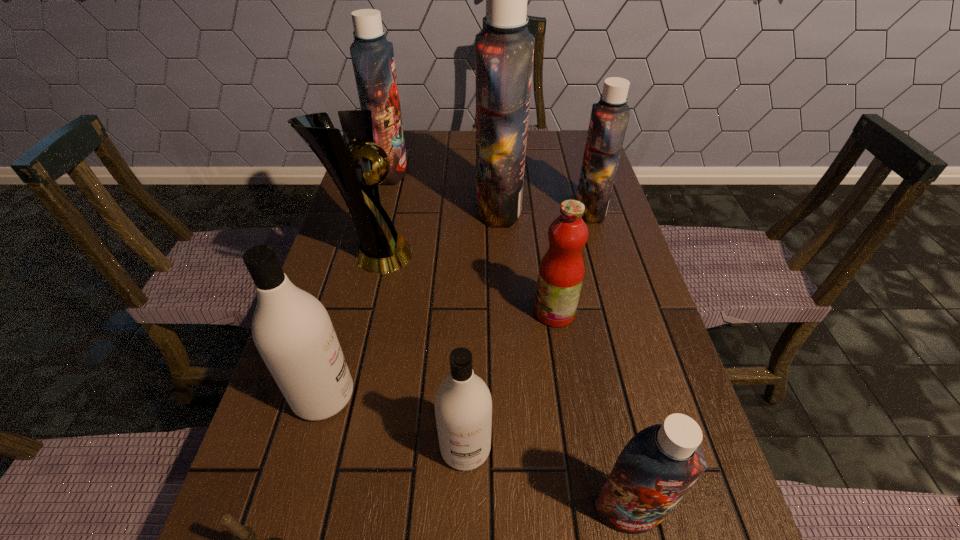
Where is `vacant space located 0.080m on the front-facing side of the left white shampoo`? This screenshot has width=960, height=540. vacant space located 0.080m on the front-facing side of the left white shampoo is located at coordinates (396, 395).

The width and height of the screenshot is (960, 540). Find the location of `blank space located 0.140m on the front label of the fruit juice`. blank space located 0.140m on the front label of the fruit juice is located at coordinates (471, 312).

I want to click on vacant space positioned 0.080m on the front label of the fruit juice, so click(x=498, y=312).

Where is `vacant space located on the front label of the fruit juice`? The image size is (960, 540). vacant space located on the front label of the fruit juice is located at coordinates (359, 312).

Find the location of a particular element. This screenshot has height=540, width=960. free space located 0.080m on the front-facing side of the right white shampoo is located at coordinates (464, 527).

What are the coordinates of `object that is at the far edge` in the screenshot? It's located at (372, 55).

Where is `award that is at the left edge`? The image size is (960, 540). award that is at the left edge is located at coordinates (355, 169).

Where is `object that is at the far left corner`? object that is at the far left corner is located at coordinates (372, 55).

Image resolution: width=960 pixels, height=540 pixels. Find the location of `vacant space at the far edge of the desktop`. vacant space at the far edge of the desktop is located at coordinates (455, 165).

Locate an element on the screen. The height and width of the screenshot is (540, 960). blank space at the left edge of the desktop is located at coordinates (299, 461).